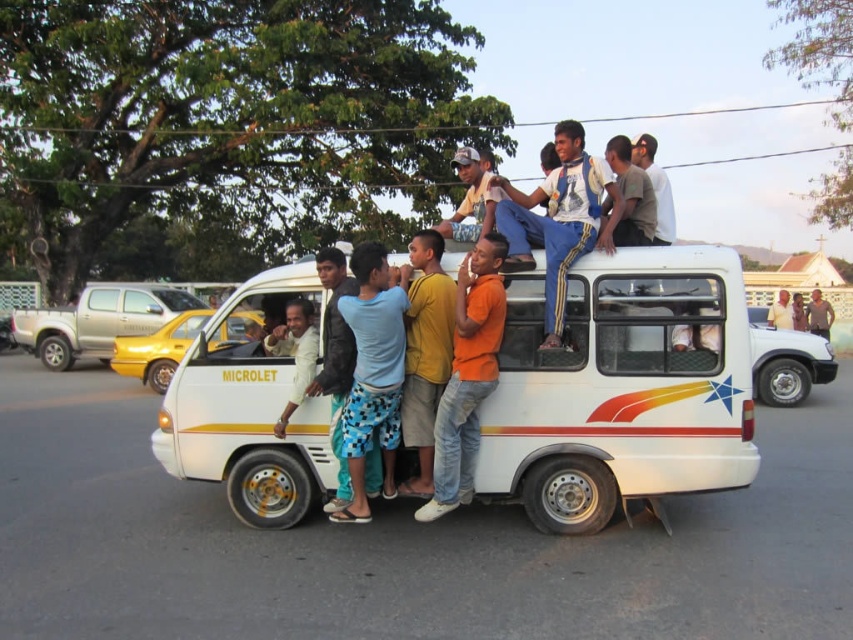
Between white glossy van at center and light brown leather jacket at center, which one appears on the right side from the viewer's perspective?

light brown leather jacket at center is more to the right.

Is point (224, 339) less distant than point (302, 321)?

No, (224, 339) is behind (302, 321).

You are a GUI agent. You are given a task and a screenshot of the screen. Output one action in this format:
    pyautogui.click(x=<x>, y=<y>)
    Task: Click on the white glossy van at center
    Image resolution: width=853 pixels, height=640 pixels.
    Given the screenshot: What is the action you would take?
    click(157, 349)

Does white cotton shirt at upper center have a greater height compared to orange cotton shirt at center?

Incorrect, white cotton shirt at upper center's height is not larger of orange cotton shirt at center's.

Is point (576, 141) less distant than point (479, 388)?

No, (576, 141) is further to viewer.

In order to click on white cotton shirt at upper center in this screenshot , I will do `click(560, 220)`.

Which is behind, point (161, 333) or point (662, 227)?

Positioned behind is point (161, 333).

Is white glossy van at center shorter than gray cotton shirt at upper right?

Correct, white glossy van at center is not as tall as gray cotton shirt at upper right.

What do you see at coordinates (157, 349) in the screenshot? I see `white glossy van at center` at bounding box center [157, 349].

Locate an element on the screen. white glossy van at center is located at coordinates (157, 349).